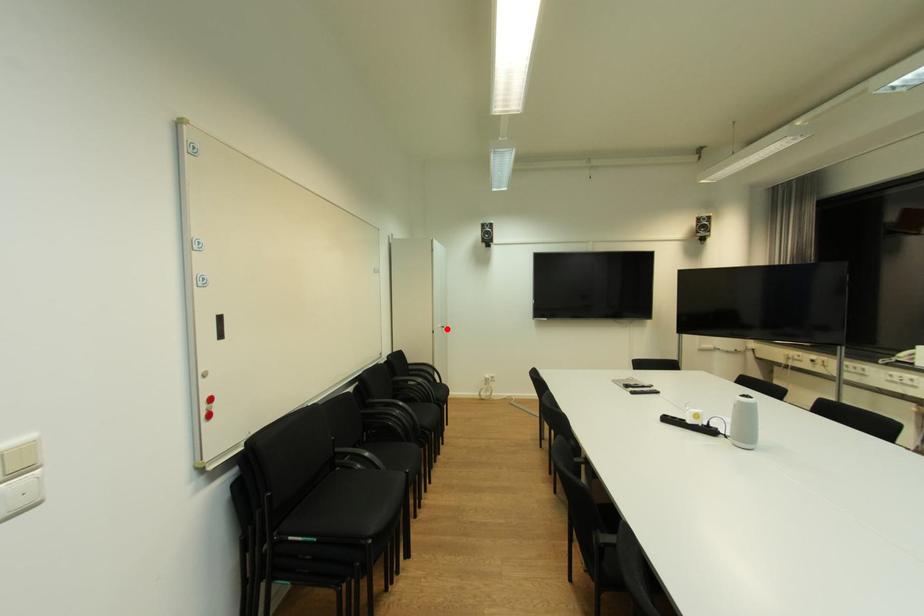
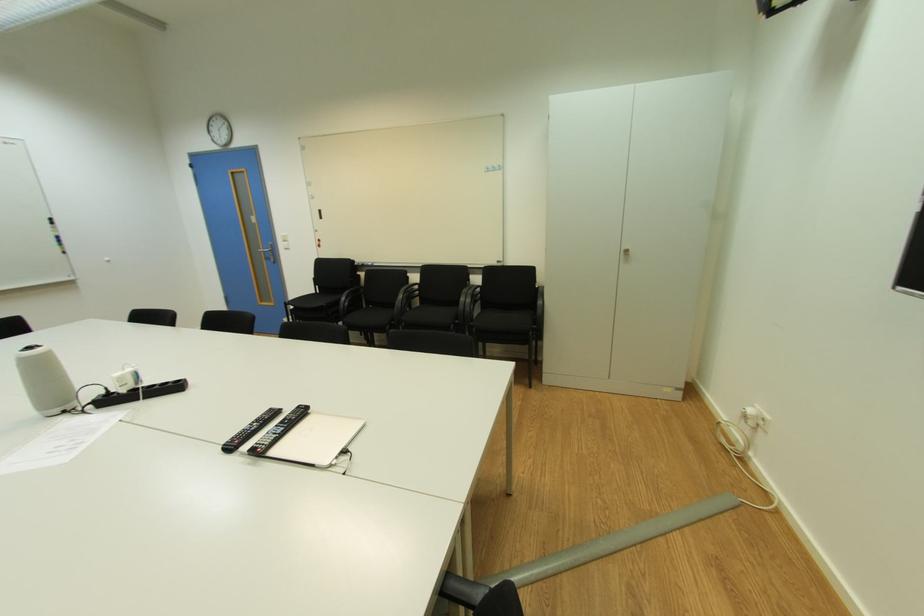
Question: I am providing you with two images of the same scene from different viewpoints. A red point is marked on the first image. Is the red point's position out of view in image 2?

Choices:
 (A) Yes
 (B) No

Answer: (B)